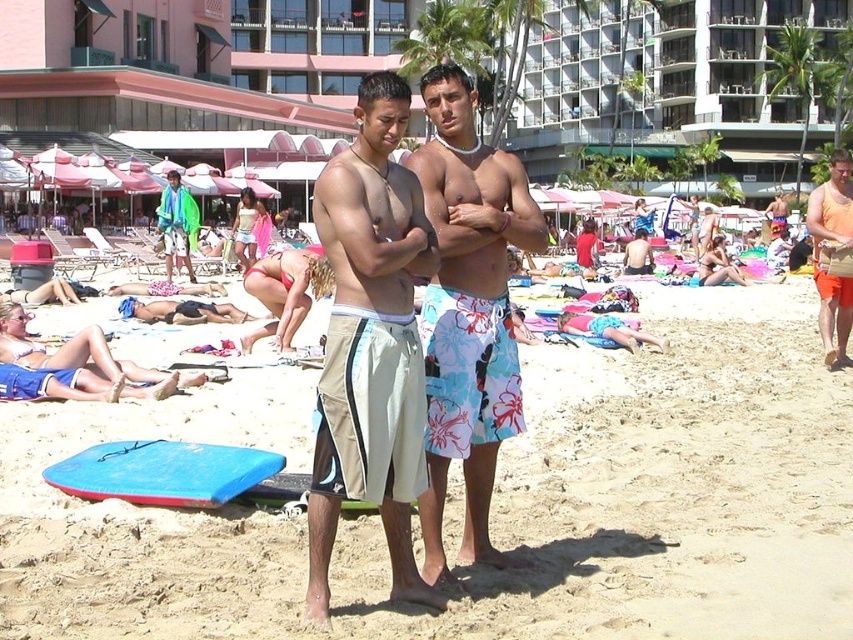
Which is behind, point (381, 262) or point (576, 243)?

Positioned behind is point (576, 243).

Does floral swim trunks at center have a lesser width compared to red fabric bikini bottom at center?

Yes, floral swim trunks at center is thinner than red fabric bikini bottom at center.

Where is `floral swim trunks at center`? Image resolution: width=853 pixels, height=640 pixels. floral swim trunks at center is located at coordinates (369, 227).

Find the location of a particular element. Image resolution: width=853 pixels, height=640 pixels. floral swim trunks at center is located at coordinates (369, 227).

Who is higher up, smooth tan skin at center or neon green towel at center?

Positioned higher is neon green towel at center.

Who is more distant from viewer, (x=422, y=182) or (x=171, y=272)?

The point (x=171, y=272) is behind.

Identify the location of smooth tan skin at center. (442, 205).

Based on the photo, measure the distance from beige sand at center to smooth tan skin at center.

A distance of 4.20 meters exists between beige sand at center and smooth tan skin at center.

Describe the element at coordinates (492, 500) in the screenshot. I see `beige sand at center` at that location.

Is point (682, 330) positioned behind point (474, 230)?

Yes, it is behind point (474, 230).

Locate an element on the screen. beige sand at center is located at coordinates (492, 500).